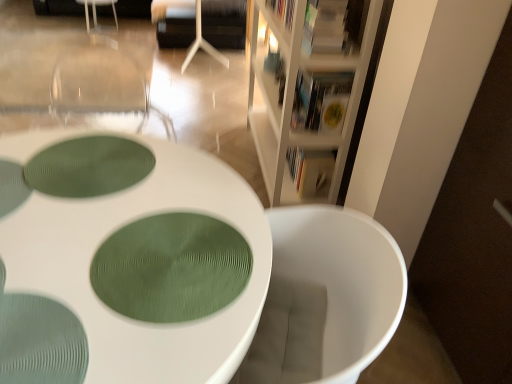
Question: Is matte white book at upper right, placed as the 1th book when sorted from top to bottom, to the left of white matte armchair at upper center from the viewer's perspective?

Choices:
 (A) no
 (B) yes

Answer: (A)

Question: Can you confirm if matte white book at upper right, which is the third book from back to front, is positioned to the right of white matte armchair at upper center?

Choices:
 (A) no
 (B) yes

Answer: (B)

Question: Is matte white book at upper right, the third book from the bottom, further to camera compared to white matte armchair at upper center?

Choices:
 (A) no
 (B) yes

Answer: (A)

Question: Can you confirm if matte white book at upper right, the third book from the bottom, is thinner than white matte armchair at upper center?

Choices:
 (A) yes
 (B) no

Answer: (A)

Question: Is matte white book at upper right, placed as the 1th book when sorted from top to bottom, positioned in front of white matte armchair at upper center?

Choices:
 (A) no
 (B) yes

Answer: (B)

Question: Is matte white book at upper right, placed as the 1th book when sorted from top to bottom, positioned with its back to white matte armchair at upper center?

Choices:
 (A) no
 (B) yes

Answer: (A)

Question: Is white wood bookcase at upper right at the left side of green textured oval at center, the 1th oval from the bottom?

Choices:
 (A) yes
 (B) no

Answer: (B)

Question: Is white wood bookcase at upper right taller than green textured oval at center, marked as the 1th oval in a front-to-back arrangement?

Choices:
 (A) no
 (B) yes

Answer: (B)

Question: Is white wood bookcase at upper right outside of green textured oval at center, marked as the 1th oval in a front-to-back arrangement?

Choices:
 (A) no
 (B) yes

Answer: (B)

Question: Is white wood bookcase at upper right thinner than green textured oval at center, which ranks as the second oval in top-to-bottom order?

Choices:
 (A) yes
 (B) no

Answer: (A)

Question: Is white wood bookcase at upper right wider than green textured oval at center, marked as the 1th oval in a front-to-back arrangement?

Choices:
 (A) no
 (B) yes

Answer: (A)

Question: Considering the relative sizes of white wood bookcase at upper right and green textured oval at center, the 1th oval from the bottom, in the image provided, is white wood bookcase at upper right bigger than green textured oval at center, the 1th oval from the bottom,?

Choices:
 (A) yes
 (B) no

Answer: (A)

Question: Can you confirm if white wood bookcase at upper right is thinner than hardcover book at upper center, which is counted as the 2th book, starting from the top?

Choices:
 (A) no
 (B) yes

Answer: (A)